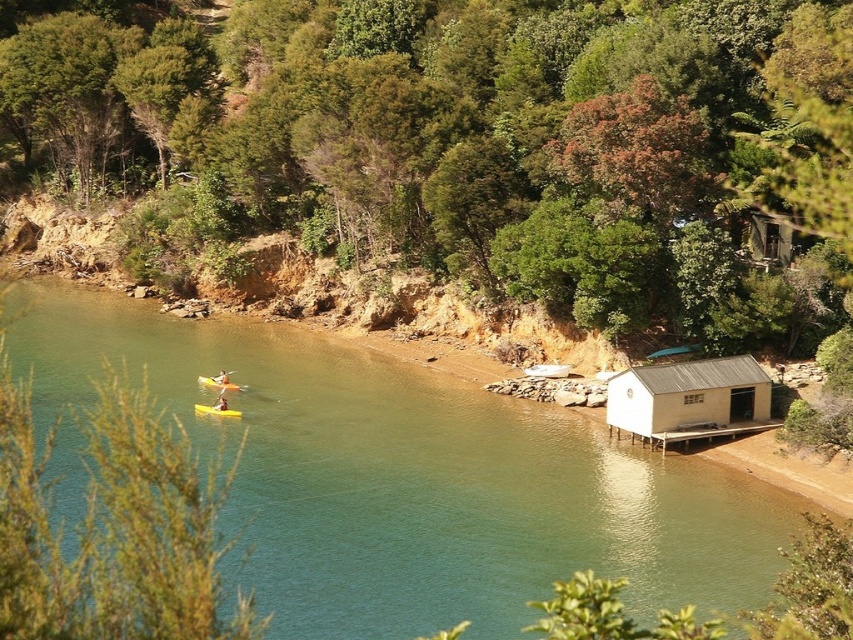
Question: Which object is farther from the camera taking this photo?

Choices:
 (A) orange kayak at center
 (B) yellow foam at center
 (C) green smooth water at center
 (D) white matte hut at lower right

Answer: (A)

Question: In this image, where is orange kayak at center located relative to yellow foam at center?

Choices:
 (A) below
 (B) above

Answer: (B)

Question: Is orange kayak at center to the right of yellow foam at center from the viewer's perspective?

Choices:
 (A) no
 (B) yes

Answer: (A)

Question: Which of the following is the farthest from the observer?

Choices:
 (A) (x=708, y=372)
 (B) (x=219, y=372)
 (C) (x=207, y=410)

Answer: (B)

Question: Among these objects, which one is farthest from the camera?

Choices:
 (A) yellow matte canoe at center
 (B) yellow foam at center
 (C) green smooth water at center

Answer: (B)

Question: Can you confirm if orange kayak at center is positioned to the left of yellow foam at center?

Choices:
 (A) no
 (B) yes

Answer: (B)